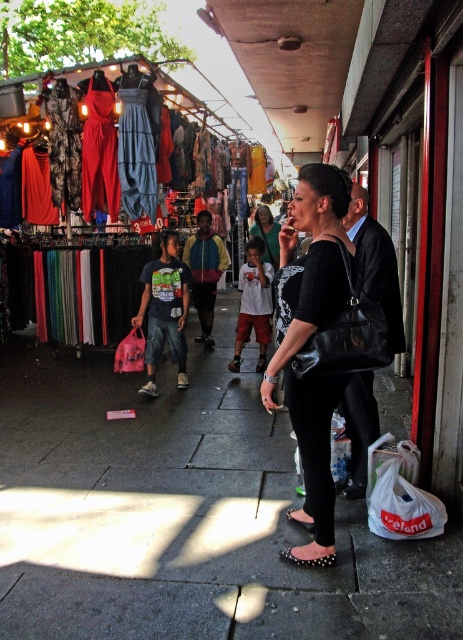
You are standing at the edge of the market and see the smooth concrete pavement at center and the multicolored jacket at center. Which object is located to the right of the other?

The smooth concrete pavement at center is positioned on the right side of multicolored jacket at center.

You are a delivery person who needs to place a small package between the multicolored jacket at center and the black leather sandal at center. Can you fit it there?

The multicolored jacket at center is larger in size than the black leather sandal at center, so there might be enough space between them to fit the small package.